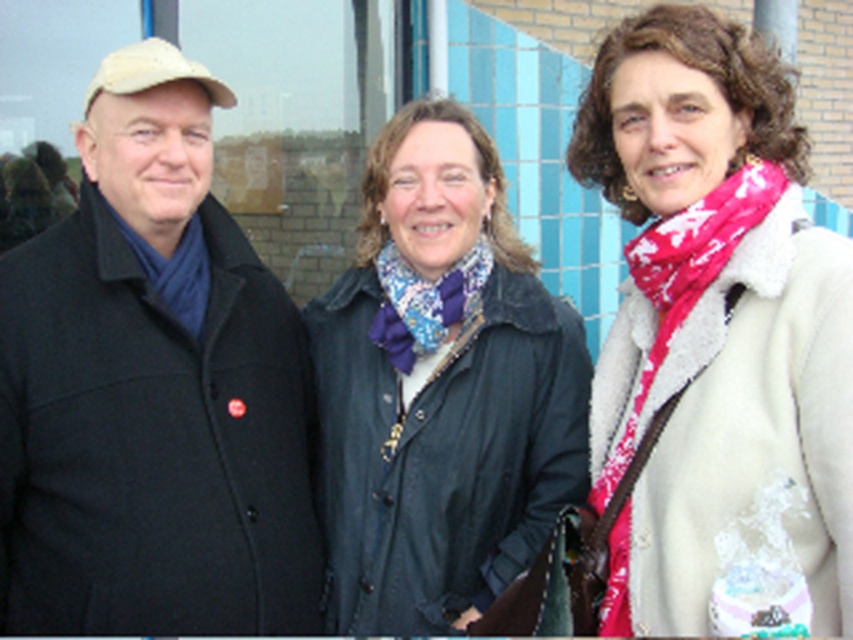
You are a fashion designer observing the three people in the image. You need to determine which scarf is narrower between the pink printed scarf at center and the blue textured scarf at center. Which one is it?

The pink printed scarf at center has a lesser width compared to the blue textured scarf at center, so the pink printed scarf at center is narrower.

You are a photographer trying to capture a photo of the black wool coat at left and the pink printed scarf at center. Since you want to ensure both are clearly visible in the frame, which object should you focus on first to account for their sizes?

The black wool coat at left is taller than the pink printed scarf at center, so you should focus on the black wool coat at left first to ensure its full height is captured clearly before adjusting for the smaller pink printed scarf at center.